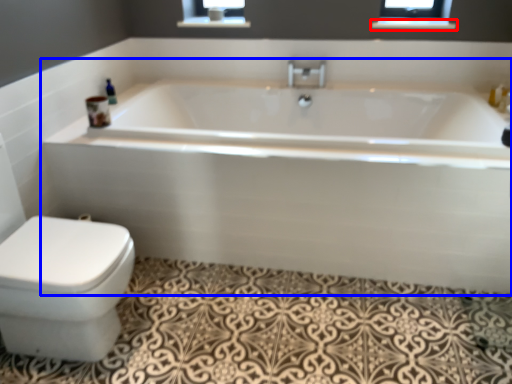
Question: Which object is closer to the camera taking this photo, balustrade (highlighted by a red box) or bathtub (highlighted by a blue box)?

Choices:
 (A) balustrade
 (B) bathtub

Answer: (B)